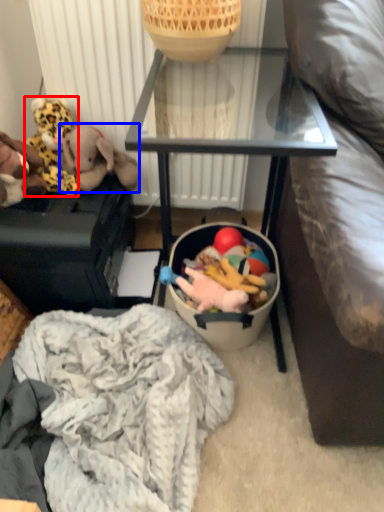
Question: Which object appears farthest to the camera in this image, toy (highlighted by a red box) or toy (highlighted by a blue box)?

Choices:
 (A) toy
 (B) toy

Answer: (A)